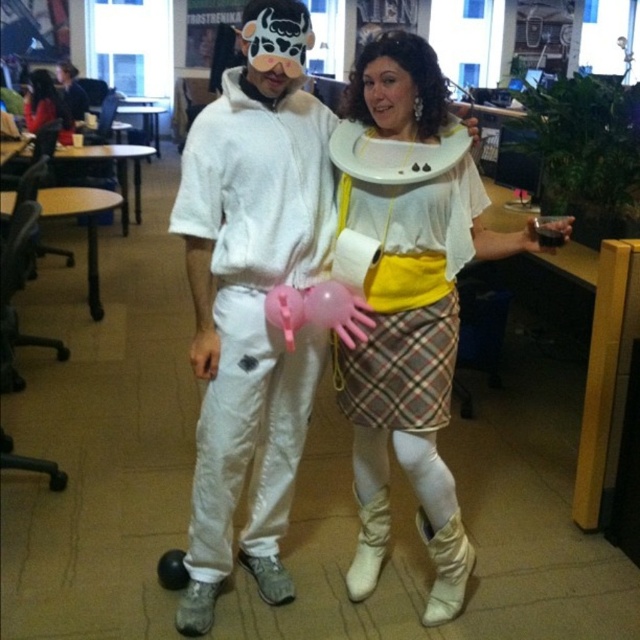
Can you confirm if yellow plaid skirt at center is positioned to the right of matte black laptop at upper left?

Indeed, yellow plaid skirt at center is positioned on the right side of matte black laptop at upper left.

You are a GUI agent. You are given a task and a screenshot of the screen. Output one action in this format:
    pyautogui.click(x=<x>, y=<y>)
    Task: Click on the yellow plaid skirt at center
    The image size is (640, 640).
    Given the screenshot: What is the action you would take?
    pyautogui.click(x=406, y=296)

The image size is (640, 640). I want to click on yellow plaid skirt at center, so click(406, 296).

Can you confirm if white matte sweatshirt at center is taller than matte black laptop at upper left?

Yes.

Does white matte sweatshirt at center appear under matte black laptop at upper left?

Yes.

At what (x,y) coordinates should I click in order to perform the action: click on white matte sweatshirt at center. Please return your answer as a coordinate pair (x, y). The width and height of the screenshot is (640, 640). Looking at the image, I should click on (252, 298).

Is point (28, 97) farther from viewer compared to point (72, 120)?

That is True.

Can you confirm if matte black laptop at upper left is shorter than matte white hoodie at center?

Yes, matte black laptop at upper left is shorter than matte white hoodie at center.

Between point (44, 115) and point (83, 106), which one is positioned behind?

The point (83, 106) is behind.

Where is `matte black laptop at upper left`? The width and height of the screenshot is (640, 640). matte black laptop at upper left is located at coordinates (45, 106).